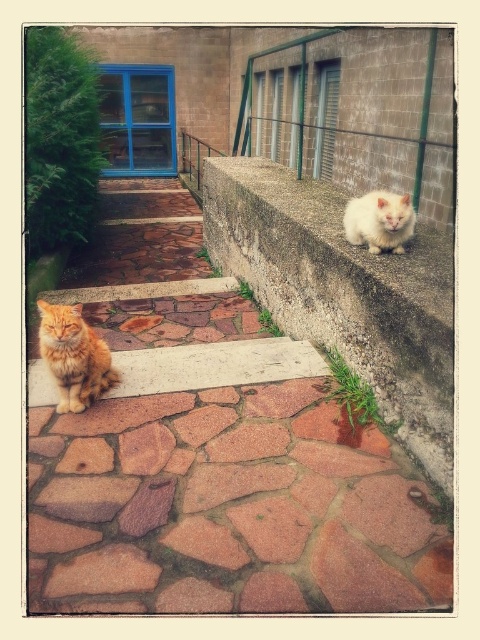
You are standing on the stone pathway and see the orange fur cat at left and the white fluffy cat at upper right. Which cat is closer to the building entrance?

The white fluffy cat at upper right is closer to the building entrance because it is positioned to the right of the orange fur cat at left, which is on the left side of the pathway leading up to the building.

You are a photographer standing at the end of the stone pathway. You want to take a photo that includes both the orange fur cat at left and the white fluffy cat at upper right. Given that your camera has a maximum focus range of 5 feet, will you be able to capture both cats in focus at the same time?

Answer: The orange fur cat at left and white fluffy cat at upper right are 4.64 feet apart from each other. Since the distance between them is within the camera maximum focus range of 5 feet, you can capture both cats in focus at the same time.